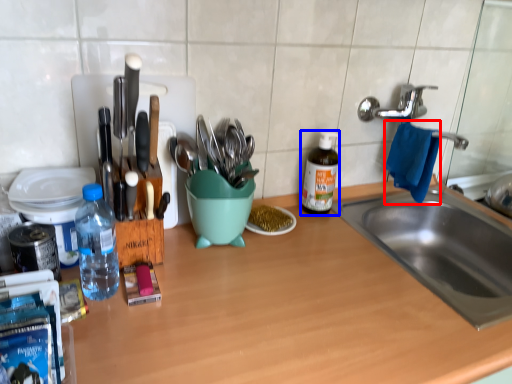
Question: Which object appears farthest to the camera in this image, hand towel (highlighted by a red box) or bottle (highlighted by a blue box)?

Choices:
 (A) hand towel
 (B) bottle

Answer: (B)